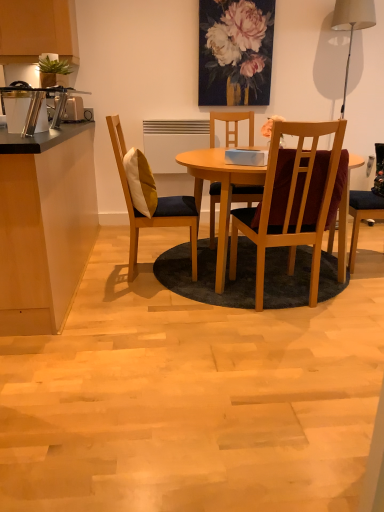
At what (x,y) coordinates should I click in order to perform the action: click on free spot in front of wooden chair at center, which is the 2th chair in left-to-right order. Please return your answer as a coordinate pair (x, y). The image size is (384, 512). Looking at the image, I should click on (295, 331).